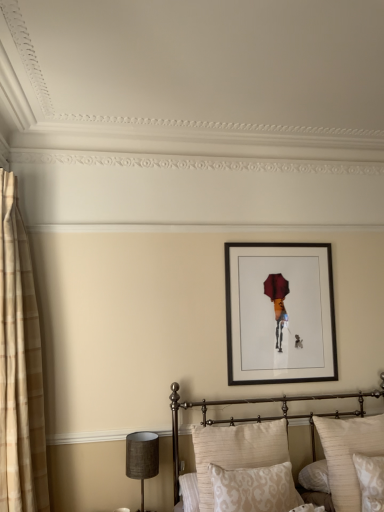
Question: Considering the positions of black matte picture frame at upper center and white damask pillow at lower right, marked as the second pillow in a right-to-left arrangement, in the image, is black matte picture frame at upper center bigger or smaller than white damask pillow at lower right, marked as the second pillow in a right-to-left arrangement,?

Choices:
 (A) small
 (B) big

Answer: (B)

Question: Is black matte picture frame at upper center inside or outside of white damask pillow at lower right, placed as the 3th pillow when sorted from left to right?

Choices:
 (A) inside
 (B) outside

Answer: (B)

Question: Estimate the real-world distances between objects in this image. Which object is closer to the beige damask pillow at lower center, arranged as the second pillow when viewed from the left?

Choices:
 (A) white damask pillow at lower right, marked as the second pillow in a right-to-left arrangement
 (B) beige plaid curtain at left
 (C) metallic gold bed at center
 (D) beige textured pillow at lower right, which is the 4th pillow from left to right
 (E) matte brown lampshade at lower left

Answer: (D)

Question: Based on their relative distances, which object is farther from the beige plaid curtain at left?

Choices:
 (A) matte brown lampshade at lower left
 (B) beige damask pillow at lower center, arranged as the second pillow when viewed from the left
 (C) metallic gold bed at center
 (D) black matte picture frame at upper center
 (E) white damask pillow at lower right, marked as the second pillow in a right-to-left arrangement

Answer: (E)